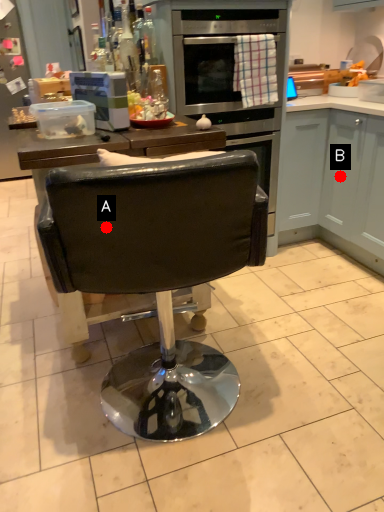
Question: Two points are circled on the image, labeled by A and B beside each circle. Which point is closer to the camera?

Choices:
 (A) A is closer
 (B) B is closer

Answer: (A)